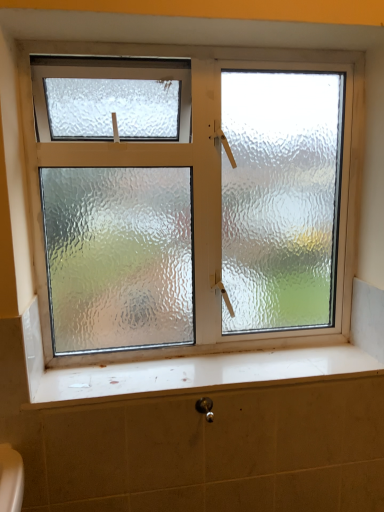
Question: Is black metallic shower at lower center completely or partially inside frosted glass window at center?

Choices:
 (A) no
 (B) yes

Answer: (A)

Question: Is frosted glass window at center facing towards black metallic shower at lower center?

Choices:
 (A) yes
 (B) no

Answer: (A)

Question: Is frosted glass window at center at the right side of black metallic shower at lower center?

Choices:
 (A) no
 (B) yes

Answer: (A)

Question: From the image's perspective, is frosted glass window at center under black metallic shower at lower center?

Choices:
 (A) yes
 (B) no

Answer: (B)

Question: Can you confirm if frosted glass window at center is bigger than black metallic shower at lower center?

Choices:
 (A) yes
 (B) no

Answer: (A)

Question: Does frosted glass window at center have a smaller size compared to black metallic shower at lower center?

Choices:
 (A) yes
 (B) no

Answer: (B)

Question: From a real-world perspective, is black metallic shower at lower center on top of white glossy window sill at lower center?

Choices:
 (A) no
 (B) yes

Answer: (A)

Question: Does black metallic shower at lower center have a larger size compared to white glossy window sill at lower center?

Choices:
 (A) no
 (B) yes

Answer: (A)

Question: Is white glossy window sill at lower center located within black metallic shower at lower center?

Choices:
 (A) no
 (B) yes

Answer: (A)

Question: From a real-world perspective, is black metallic shower at lower center under white glossy window sill at lower center?

Choices:
 (A) no
 (B) yes

Answer: (B)

Question: From the image's perspective, is black metallic shower at lower center located beneath white glossy window sill at lower center?

Choices:
 (A) no
 (B) yes

Answer: (B)

Question: Is black metallic shower at lower center directly adjacent to white glossy window sill at lower center?

Choices:
 (A) yes
 (B) no

Answer: (B)

Question: From the image's perspective, is black metallic shower at lower center beneath frosted glass window at center?

Choices:
 (A) yes
 (B) no

Answer: (A)